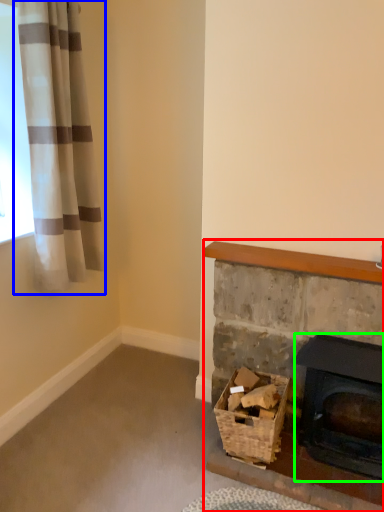
Question: Which object is positioned closest to fireplace (highlighted by a red box)? Select from curtain (highlighted by a blue box) and fireplace (highlighted by a green box).

Choices:
 (A) curtain
 (B) fireplace

Answer: (B)